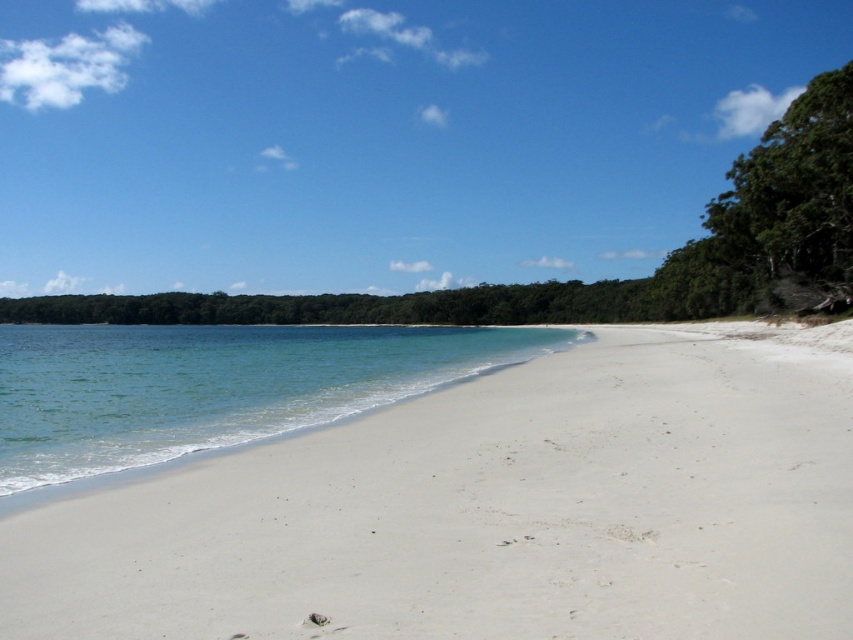
Question: Which point appears closest to the camera in this image?

Choices:
 (A) (114, 380)
 (B) (456, 506)

Answer: (B)

Question: Observing the image, what is the correct spatial positioning of white sandy beach at center in reference to clear water at lower left?

Choices:
 (A) left
 (B) right

Answer: (B)

Question: Does white sandy beach at center have a smaller size compared to clear water at lower left?

Choices:
 (A) no
 (B) yes

Answer: (B)

Question: Can you confirm if white sandy beach at center is thinner than clear water at lower left?

Choices:
 (A) yes
 (B) no

Answer: (A)

Question: Which of the following is the farthest from the observer?

Choices:
 (A) white sandy beach at center
 (B) clear water at lower left

Answer: (B)